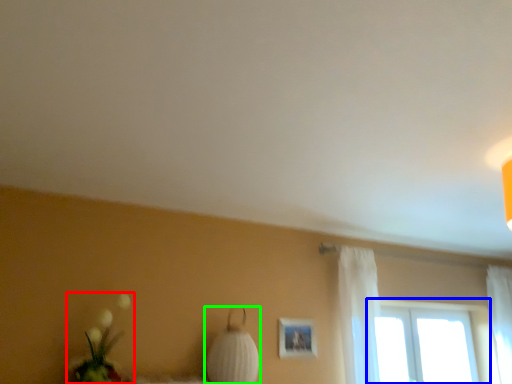
Question: Based on their relative distances, which object is nearer to floral arrangement (highlighted by a red box)? Choose from window (highlighted by a blue box) and table lamp (highlighted by a green box).

Choices:
 (A) window
 (B) table lamp

Answer: (B)